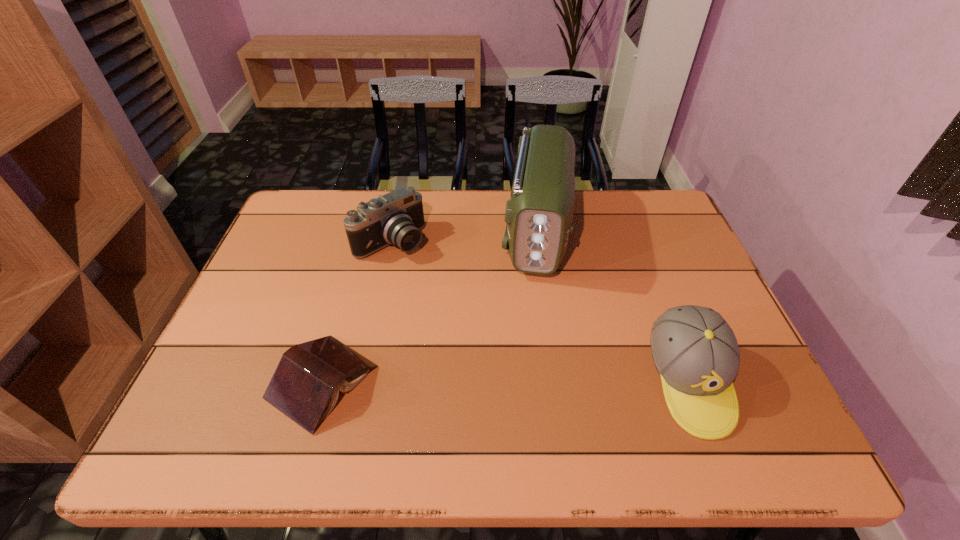
Identify the location of vacant space located 0.370m on the front-facing side of the radio_receiver. (525, 404).

Where is `vacant area situated on the front-facing side of the radio_receiver`? The image size is (960, 540). vacant area situated on the front-facing side of the radio_receiver is located at coordinates (533, 320).

This screenshot has width=960, height=540. I want to click on camera at the far edge, so click(396, 218).

The image size is (960, 540). Identify the location of radio_receiver that is at the far edge. (539, 214).

Image resolution: width=960 pixels, height=540 pixels. Find the location of `book located in the near edge section of the desktop`. book located in the near edge section of the desktop is located at coordinates pos(305,386).

Identify the location of baseball cap that is at the near edge. (695, 351).

I want to click on object located in the left edge section of the desktop, so click(305, 386).

The width and height of the screenshot is (960, 540). I want to click on object that is positioned at the right edge, so click(695, 351).

The height and width of the screenshot is (540, 960). Identify the location of object that is at the near left corner. (305, 386).

Identify the location of object that is at the near right corner. (695, 351).